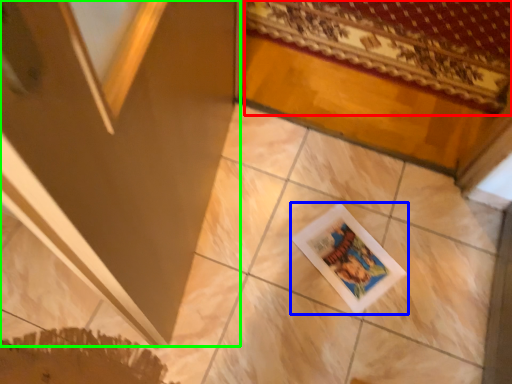
Question: Which object is the closest to the mat (highlighted by a red box)? Choose among these: picture frame (highlighted by a blue box) or screen door (highlighted by a green box).

Choices:
 (A) picture frame
 (B) screen door

Answer: (A)